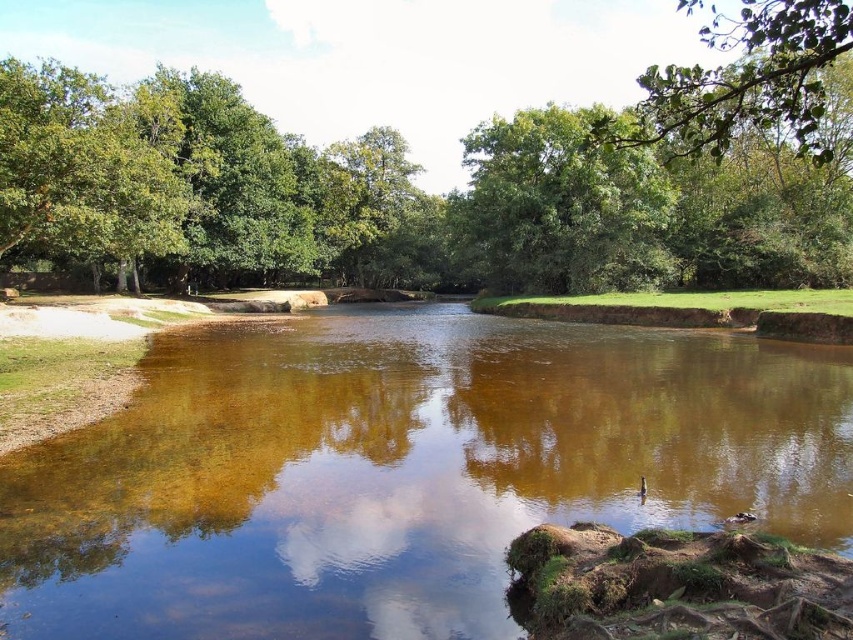
Question: Estimate the real-world distances between objects in this image. Which object is closer to the clear water at center?

Choices:
 (A) green leafy branch at upper right
 (B) green leafy tree at upper center

Answer: (A)

Question: Does green leafy tree at upper center appear on the right side of green leafy branch at upper right?

Choices:
 (A) yes
 (B) no

Answer: (B)

Question: Which point is farther to the camera?

Choices:
 (A) green leafy tree at upper center
 (B) clear water at center
 (C) green leafy branch at upper right

Answer: (A)

Question: Is clear water at center below green leafy tree at upper center?

Choices:
 (A) yes
 (B) no

Answer: (A)

Question: Observing the image, what is the correct spatial positioning of green leafy tree at upper center in reference to green leafy branch at upper right?

Choices:
 (A) above
 (B) below

Answer: (B)

Question: Which point is farther from the camera taking this photo?

Choices:
 (A) (817, 29)
 (B) (651, 228)
 (C) (231, 332)

Answer: (B)